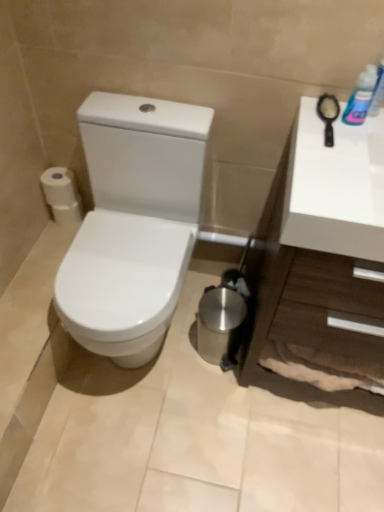
Question: From the image's perspective, does white glossy toilet at left appear lower than white matte toilet paper at left?

Choices:
 (A) no
 (B) yes

Answer: (B)

Question: Is white glossy toilet at left bigger than white matte toilet paper at left?

Choices:
 (A) yes
 (B) no

Answer: (A)

Question: Is white glossy toilet at left looking in the opposite direction of white matte toilet paper at left?

Choices:
 (A) no
 (B) yes

Answer: (A)

Question: Is white glossy toilet at left taller than white matte toilet paper at left?

Choices:
 (A) no
 (B) yes

Answer: (B)

Question: Is white glossy toilet at left beside white matte toilet paper at left?

Choices:
 (A) no
 (B) yes

Answer: (A)

Question: Can you confirm if white glossy toilet at left is smaller than white matte toilet paper at left?

Choices:
 (A) no
 (B) yes

Answer: (A)

Question: Could white glossy countertop at right be considered to be inside blue plastic bottle at upper right?

Choices:
 (A) no
 (B) yes

Answer: (A)

Question: From the image's perspective, is blue plastic bottle at upper right located beneath white glossy countertop at right?

Choices:
 (A) yes
 (B) no

Answer: (B)

Question: Considering the relative sizes of blue plastic bottle at upper right and white glossy countertop at right in the image provided, is blue plastic bottle at upper right wider than white glossy countertop at right?

Choices:
 (A) no
 (B) yes

Answer: (A)

Question: Considering the relative positions of blue plastic bottle at upper right and white glossy countertop at right in the image provided, is blue plastic bottle at upper right behind white glossy countertop at right?

Choices:
 (A) yes
 (B) no

Answer: (A)

Question: From a real-world perspective, is blue plastic bottle at upper right positioned under white glossy countertop at right based on gravity?

Choices:
 (A) yes
 (B) no

Answer: (B)

Question: Considering the relative sizes of blue plastic bottle at upper right and white glossy countertop at right in the image provided, is blue plastic bottle at upper right thinner than white glossy countertop at right?

Choices:
 (A) yes
 (B) no

Answer: (A)

Question: Is white matte toilet paper at left in contact with blue plastic bottle at upper right?

Choices:
 (A) yes
 (B) no

Answer: (B)